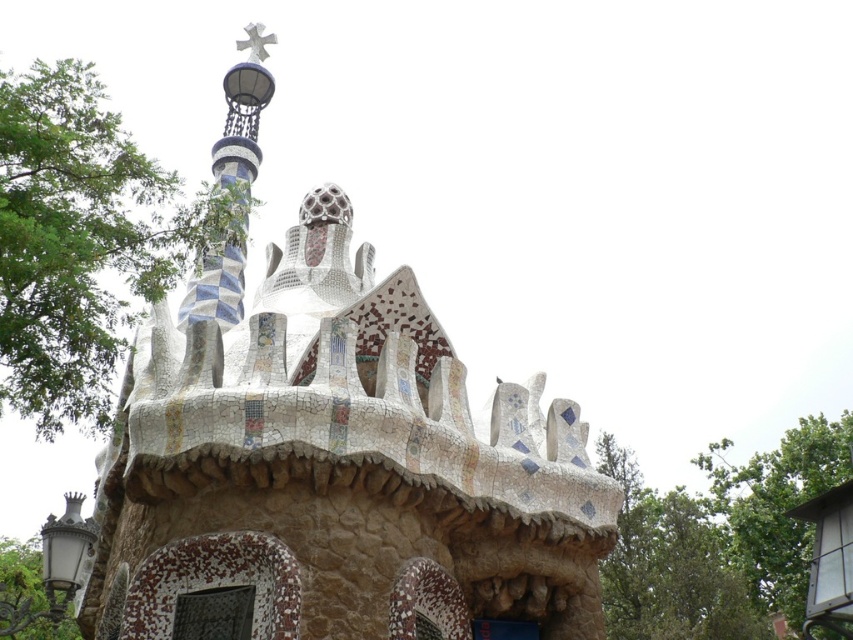
You are standing in front of the architectural structure at Park Guel in Barcelona. You want to take a photo of the mosaic stone chapel at center. Where should you position yourself to capture it in the frame?

The mosaic stone chapel at center is located at point [334,468], so you should position yourself directly in front of it to capture it in the frame.

You are an architect visiting Park Gaud in Barcelona and you see the image. You need to determine which of the two structures, the mosaic stone chapel at center or the blue mosaic spire at upper left, requires more materials for construction based on their sizes. Which one would require more materials?

The mosaic stone chapel at center is bigger than the blue mosaic spire at upper left, so it would require more materials for construction.

You are an architect visiting Park Guel in Barcelona. You notice the mosaic stone chapel at center and the blue mosaic spire at upper left. Which object is located below the other?

The mosaic stone chapel at center is positioned under the blue mosaic spire at upper left.